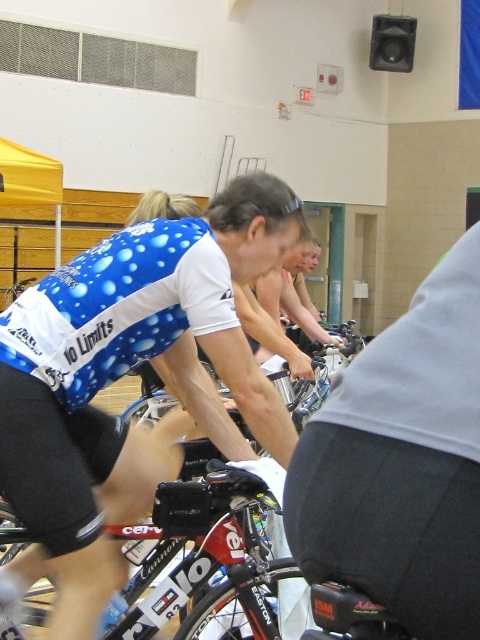
Question: Is blue/white jersey at center thinner than matte blue cycling jersey at center?

Choices:
 (A) no
 (B) yes

Answer: (A)

Question: Does blue/white jersey at center appear on the right side of matte blue cycling jersey at center?

Choices:
 (A) no
 (B) yes

Answer: (A)

Question: Which is nearer to the blue/white jersey at center?

Choices:
 (A) matte blue cycling jersey at center
 (B) shiny red bicycle at center

Answer: (B)

Question: Which point appears closest to the camera in this image?

Choices:
 (A) (265, 500)
 (B) (406, 497)
 (C) (278, 184)

Answer: (B)

Question: Which object is the farthest from the blue/white jersey at center?

Choices:
 (A) shiny red bicycle at center
 (B) matte blue cycling jersey at center

Answer: (B)

Question: Is matte blue cycling jersey at center wider than shiny red bicycle at center?

Choices:
 (A) no
 (B) yes

Answer: (A)